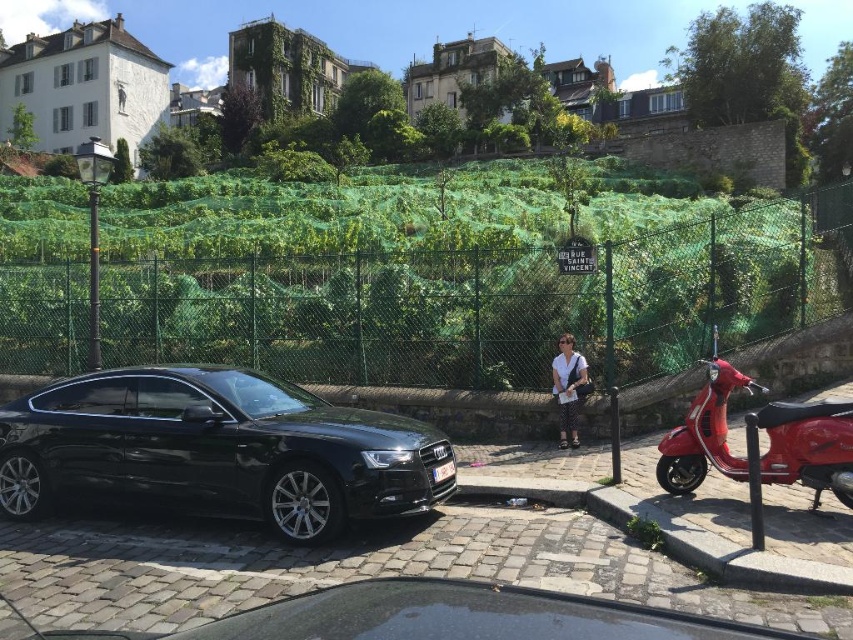
Question: Estimate the real-world distances between objects in this image. Which object is farther from the shiny red scooter at right?

Choices:
 (A) green mesh fence at center
 (B) white cotton shirt at center
 (C) shiny black sedan at lower left

Answer: (A)

Question: Can you confirm if green mesh fence at center is positioned above shiny red scooter at right?

Choices:
 (A) no
 (B) yes

Answer: (B)

Question: Which point appears closest to the camera in this image?

Choices:
 (A) [96, 413]
 (B) [697, 444]

Answer: (B)

Question: Can you confirm if shiny black sedan at lower left is positioned to the left of white cotton shirt at center?

Choices:
 (A) no
 (B) yes

Answer: (B)

Question: Considering the real-world distances, which object is farthest from the shiny black sedan at lower left?

Choices:
 (A) shiny red scooter at right
 (B) green mesh fence at center

Answer: (B)

Question: Does shiny black sedan at lower left appear on the right side of shiny red scooter at right?

Choices:
 (A) yes
 (B) no

Answer: (B)